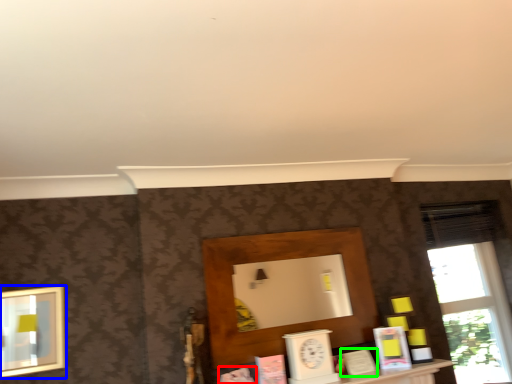
Question: Estimate the real-world distances between objects in this image. Which object is farther from book (highlighted by a red box), picture frame (highlighted by a blue box) or book (highlighted by a green box)?

Choices:
 (A) picture frame
 (B) book

Answer: (A)